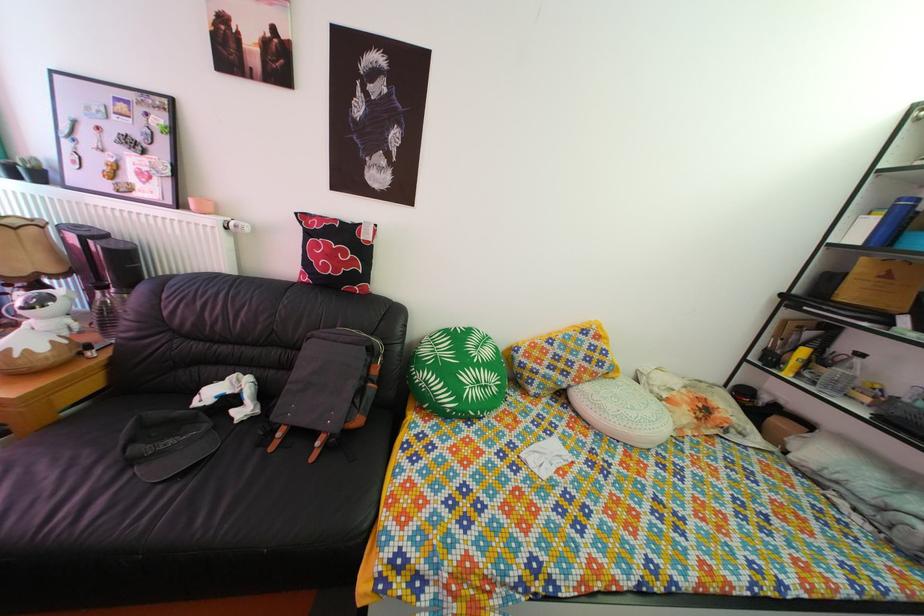
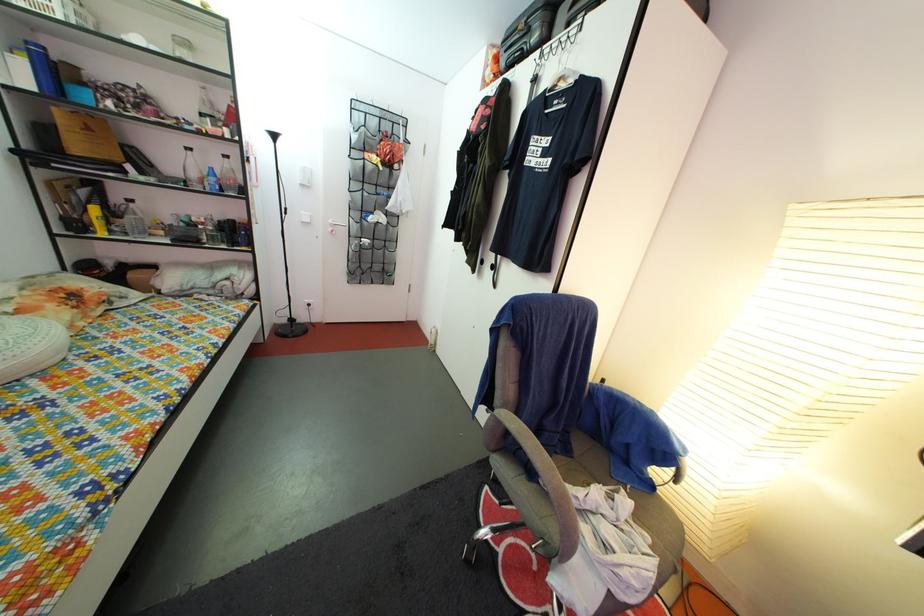
Based on the continuous images, in which direction is the camera rotating?

The camera rotated toward right-down.